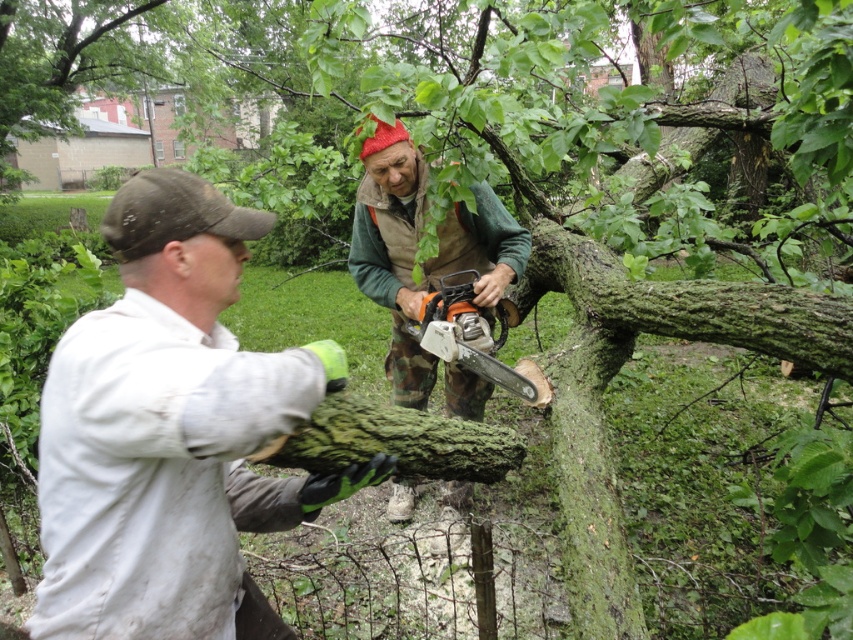
From the picture: Which is more to the left, white matte shirt at left or orange plastic chainsaw at center?

From the viewer's perspective, white matte shirt at left appears more on the left side.

Is white matte shirt at left above orange plastic chainsaw at center?

No.

Does point (128, 435) come behind point (445, 339)?

No, it is not.

You are a GUI agent. You are given a task and a screenshot of the screen. Output one action in this format:
    pyautogui.click(x=<x>, y=<y>)
    Task: Click on the white matte shirt at left
    This screenshot has width=853, height=640.
    Given the screenshot: What is the action you would take?
    pyautogui.click(x=171, y=433)

Is white matte shirt at left closer to the viewer compared to camouflage pants at center?

Yes, it is.

The width and height of the screenshot is (853, 640). I want to click on white matte shirt at left, so click(171, 433).

How much distance is there between camouflage pants at center and orange plastic chainsaw at center?

camouflage pants at center and orange plastic chainsaw at center are 9.40 inches apart from each other.

Between camouflage pants at center and orange plastic chainsaw at center, which one has less height?

orange plastic chainsaw at center is shorter.

Image resolution: width=853 pixels, height=640 pixels. Find the location of `camouflage pants at center`. camouflage pants at center is located at coordinates (415, 250).

Where is `camouflage pants at center`? The image size is (853, 640). camouflage pants at center is located at coordinates (415, 250).